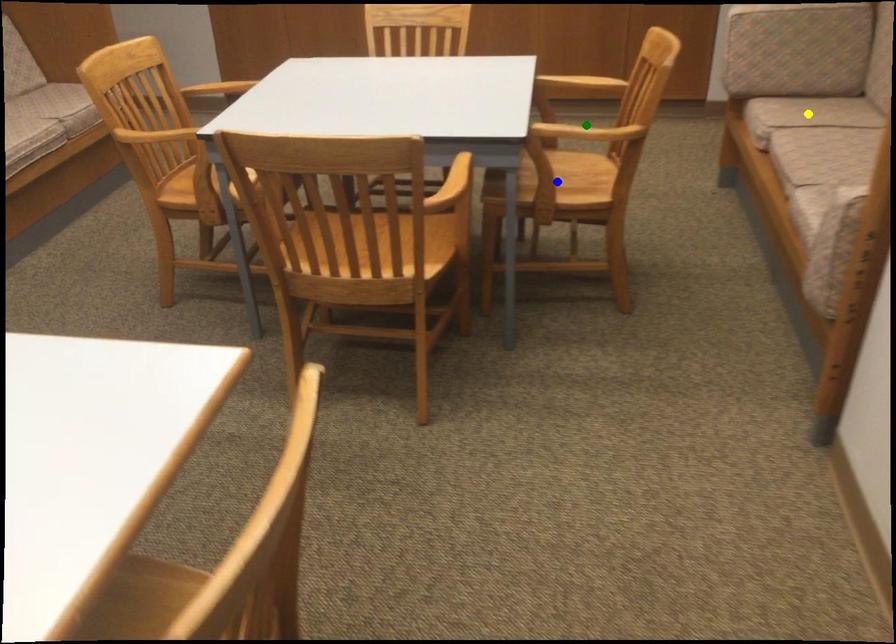
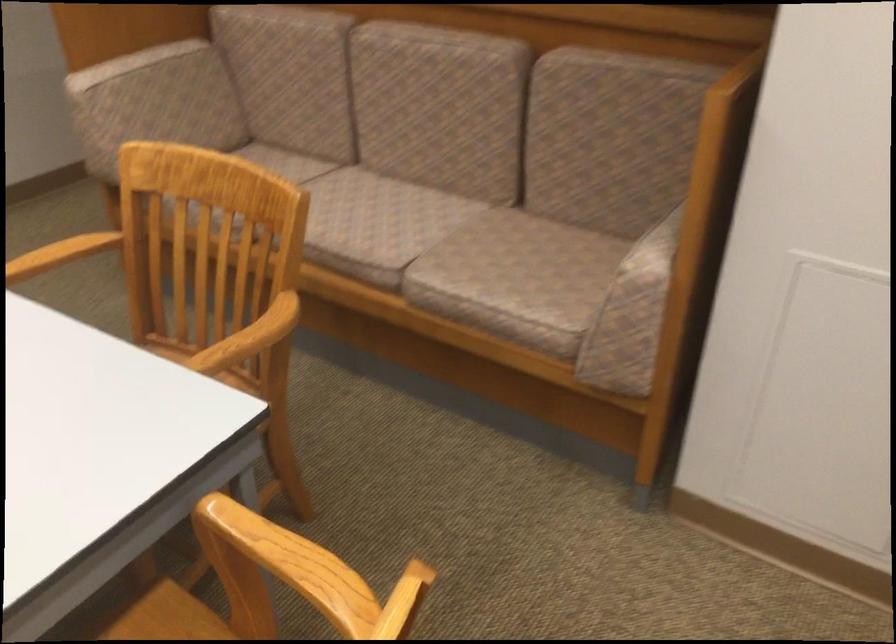
I am providing you with two images of the same scene from different viewpoints. Three points are marked in image1. Which point corresponds to a part or object that is occluded in image2?In image1, three points are marked. Which of them correspond to a part or object that is occluded in image2?Among the three points shown in image1, which one corresponds to a part or object that is no longer visible due to occlusion in image2?

blue point, yellow point